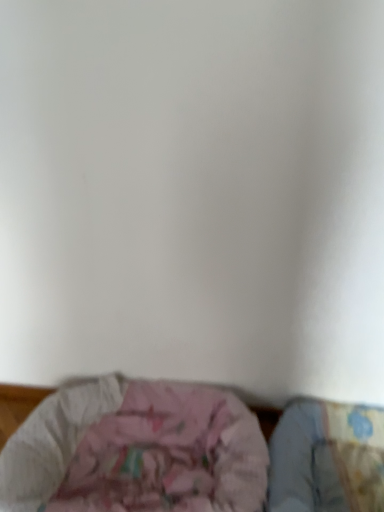
At what (x,y) coordinates should I click in order to perform the action: click on pink fabric cushion at lower center. Please return your answer as a coordinate pair (x, y). Looking at the image, I should click on (189, 453).

What do you see at coordinates (189, 453) in the screenshot? I see `pink fabric cushion at lower center` at bounding box center [189, 453].

Describe the element at coordinates (327, 458) in the screenshot. I see `fluffy cotton sheet at lower right` at that location.

What is the approximate height of fluffy cotton sheet at lower right?

fluffy cotton sheet at lower right is 8.39 inches in height.

Locate an element on the screen. This screenshot has height=512, width=384. fluffy cotton sheet at lower right is located at coordinates (327, 458).

Where is `pink fabric cushion at lower center`? pink fabric cushion at lower center is located at coordinates (189, 453).

Is pink fabric cushion at lower center at the left side of fluffy cotton sheet at lower right?

Yes, pink fabric cushion at lower center is to the left of fluffy cotton sheet at lower right.

Considering the relative positions of pink fabric cushion at lower center and fluffy cotton sheet at lower right in the image provided, is pink fabric cushion at lower center behind fluffy cotton sheet at lower right?

That is False.

Is point (166, 399) positioned after point (319, 463)?

Yes, it is.

From the image's perspective, which one is positioned higher, pink fabric cushion at lower center or fluffy cotton sheet at lower right?

From the image's view, pink fabric cushion at lower center is above.

From a real-world perspective, is pink fabric cushion at lower center below fluffy cotton sheet at lower right?

No, from a real-world perspective, pink fabric cushion at lower center is not beneath fluffy cotton sheet at lower right.

Which of these two, pink fabric cushion at lower center or fluffy cotton sheet at lower right, is wider?

pink fabric cushion at lower center.

Who is shorter, pink fabric cushion at lower center or fluffy cotton sheet at lower right?

pink fabric cushion at lower center.

Which of these two, pink fabric cushion at lower center or fluffy cotton sheet at lower right, is bigger?

Bigger between the two is pink fabric cushion at lower center.

Is fluffy cotton sheet at lower right located within pink fabric cushion at lower center?

No.

Consider the image. Are pink fabric cushion at lower center and fluffy cotton sheet at lower right beside each other?

No.

Is pink fabric cushion at lower center oriented away from fluffy cotton sheet at lower right?

That's not correct — pink fabric cushion at lower center is not looking away from fluffy cotton sheet at lower right.

What's the angular difference between pink fabric cushion at lower center and fluffy cotton sheet at lower right's facing directions?

There is a 0.000248-degree angle between the facing directions of pink fabric cushion at lower center and fluffy cotton sheet at lower right.

What are the coordinates of `furniture in front of the fluffy cotton sheet at lower right` in the screenshot? It's located at (189, 453).

Considering the positions of objects fluffy cotton sheet at lower right and pink fabric cushion at lower center in the image provided, who is more to the right, fluffy cotton sheet at lower right or pink fabric cushion at lower center?

fluffy cotton sheet at lower right.

Is fluffy cotton sheet at lower right in front of or behind pink fabric cushion at lower center in the image?

In the image, fluffy cotton sheet at lower right appears behind pink fabric cushion at lower center.

Does point (294, 403) appear closer or farther from the camera than point (230, 470)?

Clearly, point (294, 403) is more distant from the camera than point (230, 470).

From the picture: From the image's perspective, is fluffy cotton sheet at lower right below pink fabric cushion at lower center?

Yes.

Based on the photo, from a real-world perspective, which is physically below, fluffy cotton sheet at lower right or pink fabric cushion at lower center?

fluffy cotton sheet at lower right is physically lower.

Considering the sizes of fluffy cotton sheet at lower right and pink fabric cushion at lower center in the image, is fluffy cotton sheet at lower right wider or thinner than pink fabric cushion at lower center?

Clearly, fluffy cotton sheet at lower right has less width compared to pink fabric cushion at lower center.

Can you confirm if fluffy cotton sheet at lower right is shorter than pink fabric cushion at lower center?

Incorrect, the height of fluffy cotton sheet at lower right does not fall short of that of pink fabric cushion at lower center.

Consider the image. Does fluffy cotton sheet at lower right have a smaller size compared to pink fabric cushion at lower center?

Correct, fluffy cotton sheet at lower right occupies less space than pink fabric cushion at lower center.

Is fluffy cotton sheet at lower right positioned beyond the bounds of pink fabric cushion at lower center?

Answer: Indeed, fluffy cotton sheet at lower right is completely outside pink fabric cushion at lower center.

Is fluffy cotton sheet at lower right not near pink fabric cushion at lower center?

No, there isn't a large distance between fluffy cotton sheet at lower right and pink fabric cushion at lower center.

Is fluffy cotton sheet at lower right oriented towards pink fabric cushion at lower center?

No.

You are a GUI agent. You are given a task and a screenshot of the screen. Output one action in this format:
    pyautogui.click(x=<x>, y=<y>)
    Task: Click on the sheet below the pink fabric cushion at lower center (from a real-world perspective)
    
    Given the screenshot: What is the action you would take?
    pyautogui.click(x=327, y=458)

The image size is (384, 512). I want to click on sheet behind the pink fabric cushion at lower center, so click(x=327, y=458).

The width and height of the screenshot is (384, 512). Identify the location of sheet on the right of the pink fabric cushion at lower center. (327, 458).